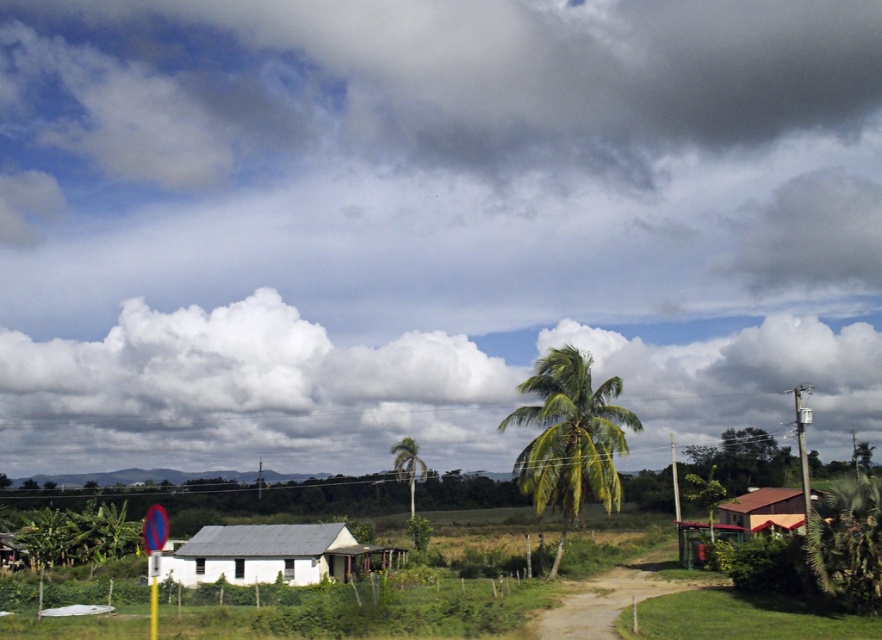
You are standing at the point marked by the coordinates (408,465) in the image. Based on the scene description, what object are you directly facing?

The point at coordinates (408,465) indicates a green leafy palm tree at center, so you are directly facing the green leafy palm tree at center.

You are standing at the center of the dirt path leading to both the brown corrugated roof hut at lower right and the white matte hut at lower left. Which direction should you walk to reach the one that is positioned higher up?

The brown corrugated roof hut at lower right is located above the white matte hut at lower left, so you should walk towards the brown corrugated roof hut at lower right to reach the one positioned higher up.